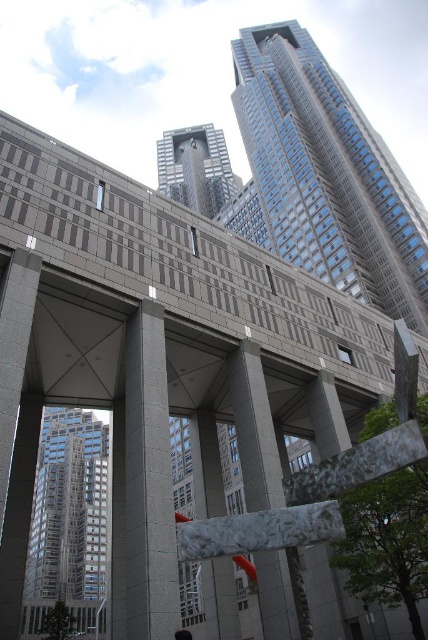
Does gray concrete pillar at center appear under sleek glass skyscraper at center?

Indeed, gray concrete pillar at center is positioned under sleek glass skyscraper at center.

At what (x,y) coordinates should I click in order to perform the action: click on gray concrete pillar at center. Please return your answer as a coordinate pair (x, y). Image resolution: width=428 pixels, height=640 pixels. Looking at the image, I should click on (142, 486).

Between silver glass tower at center and marble-like stone column at center, which one has less height?

Standing shorter between the two is marble-like stone column at center.

In the scene shown: Is silver glass tower at center to the right of marble-like stone column at center from the viewer's perspective?

Incorrect, silver glass tower at center is not on the right side of marble-like stone column at center.

Measure the distance between point [82,497] and camera.

201.45 meters

In order to click on silver glass tower at center in this screenshot , I will do `click(68, 516)`.

Can you confirm if gray concrete pillar at center is shorter than marble-like stone column at center?

No.

Is gray concrete pillar at center thinner than marble-like stone column at center?

No.

Identify the location of gray concrete pillar at center. (142, 486).

In order to click on gray concrete pillar at center in this screenshot , I will do `click(142, 486)`.